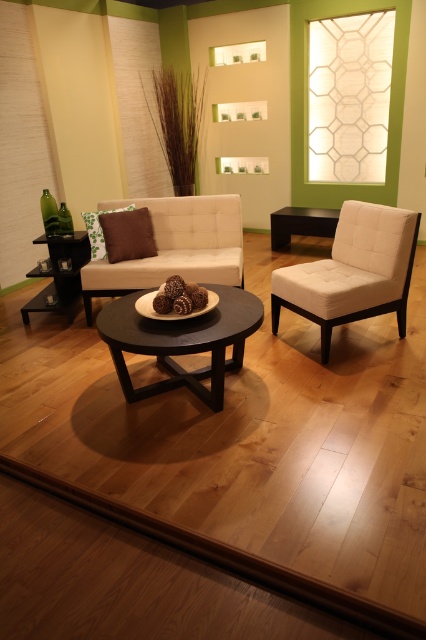
Question: Is black matte table at center smaller than brown fabric pillow at left?

Choices:
 (A) no
 (B) yes

Answer: (A)

Question: Which point appears closest to the camera in this image?

Choices:
 (A) (317, 276)
 (B) (131, 273)

Answer: (A)

Question: Based on their relative distances, which object is nearer to the black matte table at center?

Choices:
 (A) brown fabric pillow at center
 (B) beige fabric couch at center
 (C) white fabric chair at center
 (D) black wood table at center

Answer: (B)

Question: Does black wood table at center have a smaller size compared to black matte table at center?

Choices:
 (A) no
 (B) yes

Answer: (A)

Question: Can you confirm if white fabric chair at center is positioned below beige fabric couch at center?

Choices:
 (A) no
 (B) yes

Answer: (B)

Question: Which of the following is the closest to the observer?

Choices:
 (A) (115, 305)
 (B) (331, 220)
 (C) (149, 214)
 (D) (345, 244)

Answer: (A)